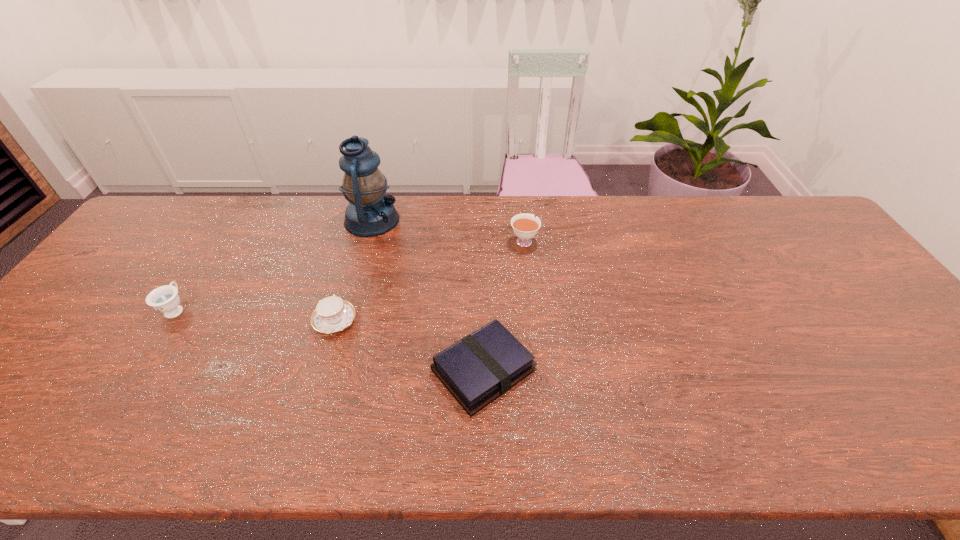
The width and height of the screenshot is (960, 540). I want to click on vacant space that satisfies the following two spatial constraints: 1. on the face of the lantern; 2. on the right side of the book, so click(330, 370).